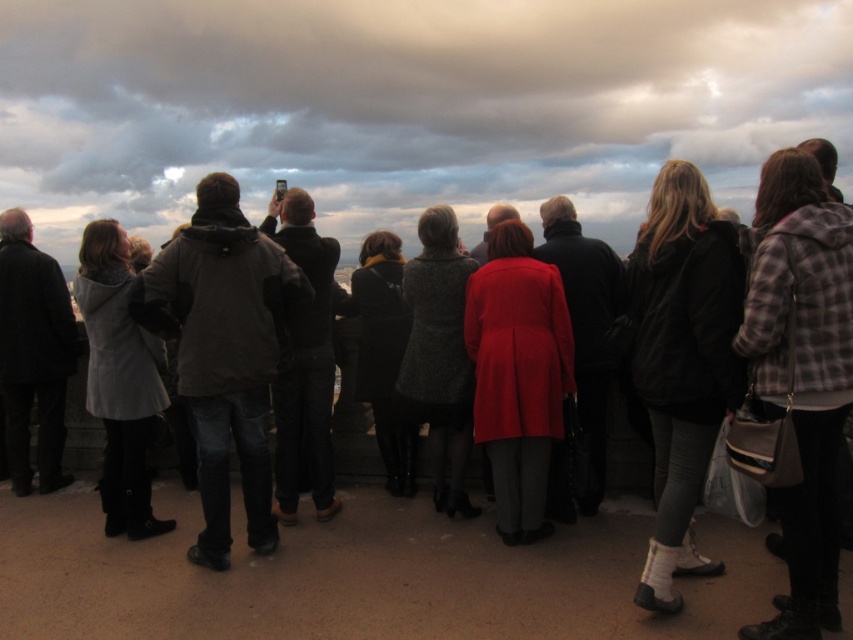
Question: Does cloudy sky at upper center appear on the left side of black leather jacket at center?

Choices:
 (A) yes
 (B) no

Answer: (A)

Question: Is plaid wool jacket at right further to the viewer compared to black leather jacket at center?

Choices:
 (A) yes
 (B) no

Answer: (B)

Question: Estimate the real-world distances between objects in this image. Which object is farther from the matte red coat at center?

Choices:
 (A) dark gray jacket at center
 (B) plaid wool jacket at right
 (C) black leather jacket at center

Answer: (B)

Question: Which is nearer to the dark gray jacket at center?

Choices:
 (A) matte red coat at center
 (B) cloudy sky at upper center

Answer: (A)

Question: Does dark gray jacket at center appear under black leather jacket at center?

Choices:
 (A) no
 (B) yes

Answer: (B)

Question: Which object is positioned closest to the matte red coat at center?

Choices:
 (A) plaid wool jacket at right
 (B) cloudy sky at upper center

Answer: (A)